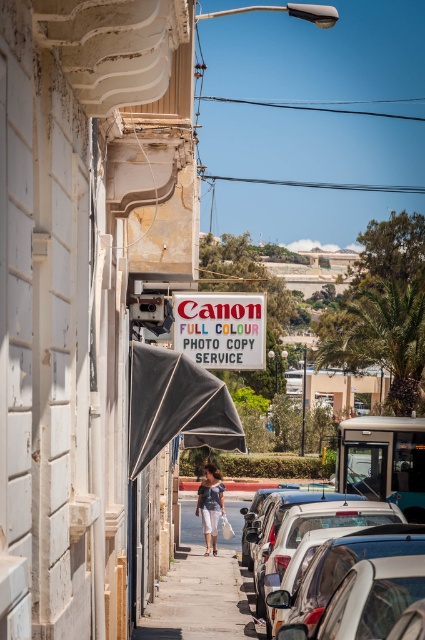
You are a photographer standing on the sidewalk. You see a white matte signboard at center and a camera. Which object is closer to you?

The white matte signboard at center is closer to you since it is 4.60 meters away from the camera.

You are a delivery person who needs to place a new sign between the white matte signboard at center and the red plastic sign at center. The new sign is 15 feet wide. Can you fit it between them without overlapping?

The distance between the white matte signboard at center and the red plastic sign at center is 30.35 feet. Since the new sign is 15 feet wide, there is enough space to place it between them without overlapping.